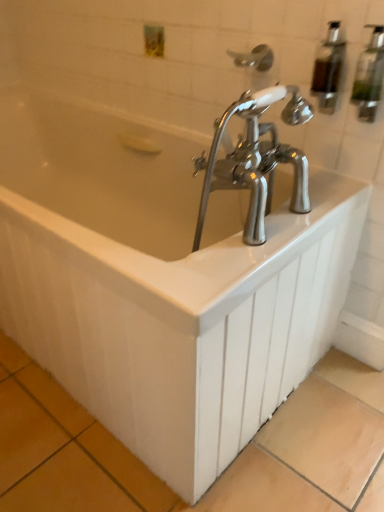
Question: Is clear glass soap dispenser at upper right, the first soap dispenser from the right, beside translucent plastic soap dispenser at upper right, which is the second soap dispenser in right-to-left order?

Choices:
 (A) yes
 (B) no

Answer: (A)

Question: Is clear glass soap dispenser at upper right, the first soap dispenser from the right, outside translucent plastic soap dispenser at upper right, which is the second soap dispenser in right-to-left order?

Choices:
 (A) no
 (B) yes

Answer: (B)

Question: From a real-world perspective, is clear glass soap dispenser at upper right, placed as the second soap dispenser when sorted from left to right, under translucent plastic soap dispenser at upper right, the first soap dispenser in the left-to-right sequence?

Choices:
 (A) no
 (B) yes

Answer: (A)

Question: Can you confirm if clear glass soap dispenser at upper right, the first soap dispenser from the right, is shorter than translucent plastic soap dispenser at upper right, which is the second soap dispenser in right-to-left order?

Choices:
 (A) yes
 (B) no

Answer: (B)

Question: Considering the relative sizes of clear glass soap dispenser at upper right, placed as the second soap dispenser when sorted from left to right, and translucent plastic soap dispenser at upper right, the first soap dispenser in the left-to-right sequence, in the image provided, is clear glass soap dispenser at upper right, placed as the second soap dispenser when sorted from left to right, taller than translucent plastic soap dispenser at upper right, the first soap dispenser in the left-to-right sequence,?

Choices:
 (A) no
 (B) yes

Answer: (B)

Question: Can you confirm if clear glass soap dispenser at upper right, the first soap dispenser from the right, is positioned to the left of translucent plastic soap dispenser at upper right, which is the second soap dispenser in right-to-left order?

Choices:
 (A) yes
 (B) no

Answer: (B)

Question: Could you tell me if clear plastic shower head at upper center is facing clear glass soap dispenser at upper right, the first soap dispenser from the right?

Choices:
 (A) yes
 (B) no

Answer: (B)

Question: Is clear plastic shower head at upper center with clear glass soap dispenser at upper right, the first soap dispenser from the right?

Choices:
 (A) yes
 (B) no

Answer: (B)

Question: Is clear plastic shower head at upper center smaller than clear glass soap dispenser at upper right, placed as the second soap dispenser when sorted from left to right?

Choices:
 (A) yes
 (B) no

Answer: (B)

Question: Does clear plastic shower head at upper center have a greater height compared to clear glass soap dispenser at upper right, the first soap dispenser from the right?

Choices:
 (A) no
 (B) yes

Answer: (A)

Question: Is clear plastic shower head at upper center shorter than clear glass soap dispenser at upper right, placed as the second soap dispenser when sorted from left to right?

Choices:
 (A) no
 (B) yes

Answer: (B)

Question: Is clear plastic shower head at upper center closer to camera compared to clear glass soap dispenser at upper right, the first soap dispenser from the right?

Choices:
 (A) yes
 (B) no

Answer: (B)

Question: Is clear plastic shower head at upper center to the left of translucent plastic soap dispenser at upper right, the first soap dispenser in the left-to-right sequence, from the viewer's perspective?

Choices:
 (A) yes
 (B) no

Answer: (A)